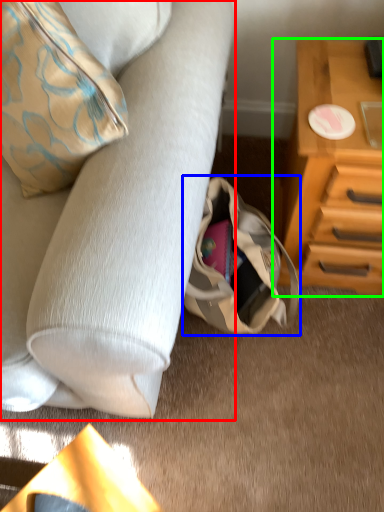
Question: Estimate the real-world distances between objects in this image. Which object is farther from studio couch (highlighted by a red box), handbag (highlighted by a blue box) or chest of drawers (highlighted by a green box)?

Choices:
 (A) handbag
 (B) chest of drawers

Answer: (B)